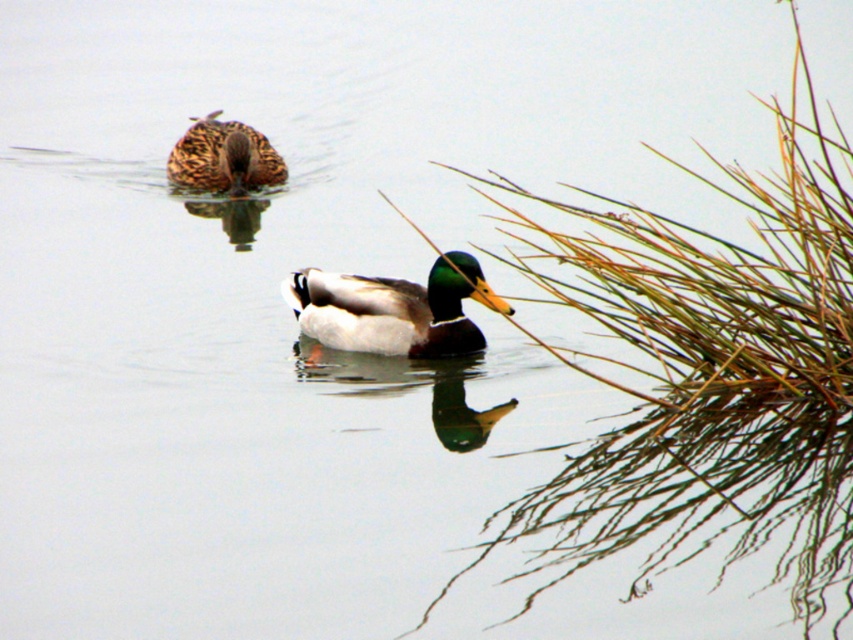
You are a photographer trying to capture both the shiny green and white duck at center and the brown matte duck at upper left in a single frame. Based on their positions, which duck should you adjust your camera to focus on first to ensure both are in the shot?

You should focus on the shiny green and white duck at center first because it is positioned to the right of the brown matte duck at upper left, so adjusting focus from left to right ensures both are captured.

You are a photographer trying to capture the reflection of the male mallard duck in the water. To ensure the brown grass at right doesn not block the reflection, where should you position your camera relative to the duck?

To avoid blocking the reflection of the male mallard duck with the brown grass at right, position your camera to the left side of the duck since the brown grass at right is located at the right side of the frame.